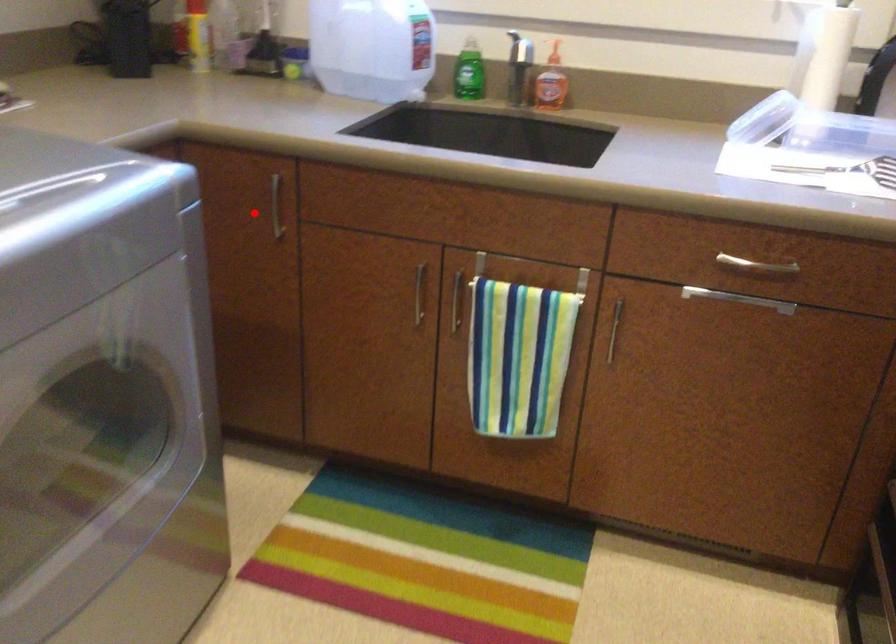
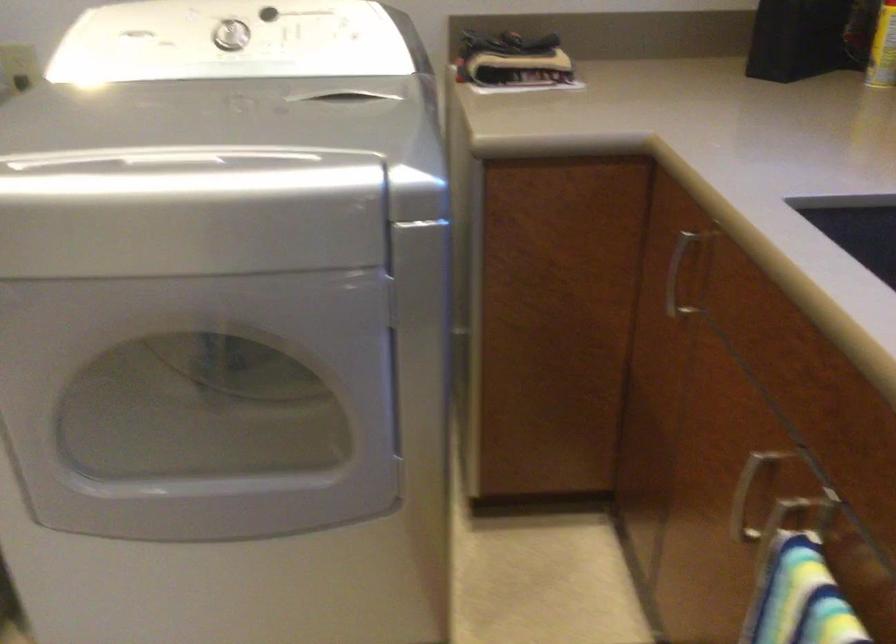
Question: I am providing you with two images of the same scene from different viewpoints. Given a red point in image1, look at the same physical point in image2. Is it:

Choices:
 (A) Closer to the viewpoint
 (B) Farther from the viewpoint

Answer: (A)